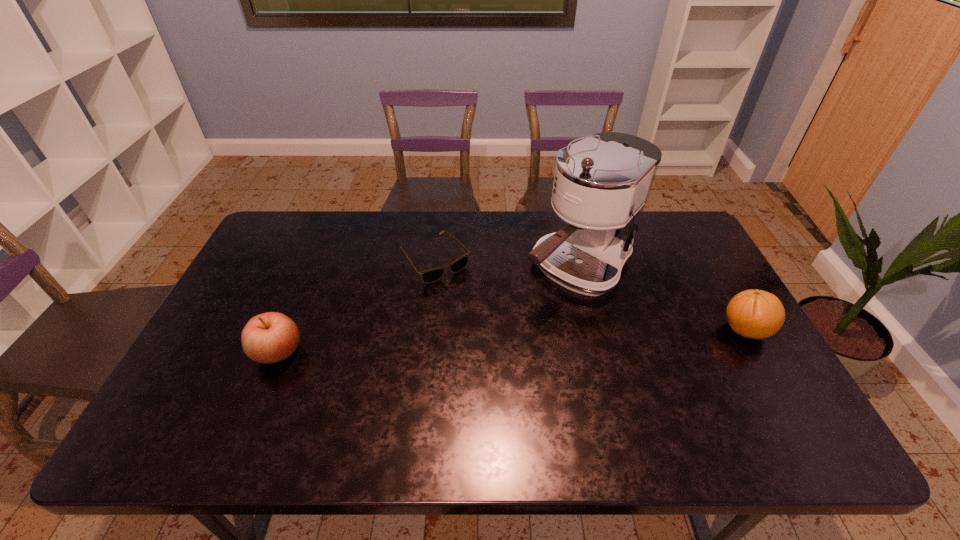
Image resolution: width=960 pixels, height=540 pixels. Find the location of `vacant region between the tallest object and the sunglasses`. vacant region between the tallest object and the sunglasses is located at coordinates (507, 265).

Where is `object that stands as the closest to the leftmost object`? The width and height of the screenshot is (960, 540). object that stands as the closest to the leftmost object is located at coordinates (429, 276).

Identify which object is the third nearest to the orange. Please provide its 2D coordinates. Your answer should be formatted as a tuple, i.e. [(x, y)], where the tuple contains the x and y coordinates of a point satisfying the conditions above.

[(270, 337)]